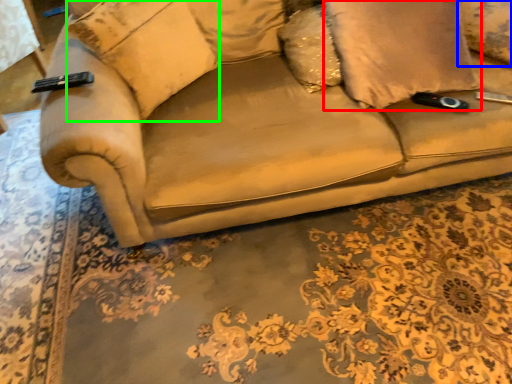
Question: Considering the real-world distances, which object is closest to pillow (highlighted by a red box)? pillow (highlighted by a blue box) or pillow (highlighted by a green box).

Choices:
 (A) pillow
 (B) pillow

Answer: (A)